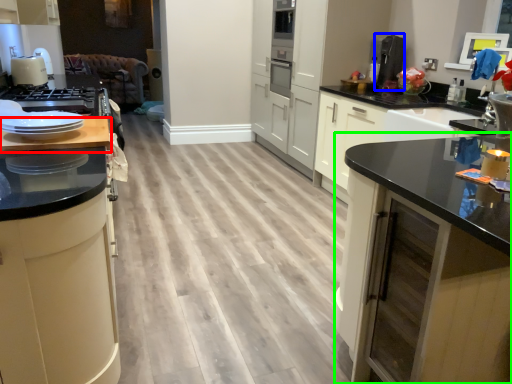
Question: Which object is positioned closest to countertop (highlighted by a red box)? Select from coffee machine (highlighted by a blue box) and cabinetry (highlighted by a green box).

Choices:
 (A) coffee machine
 (B) cabinetry

Answer: (B)